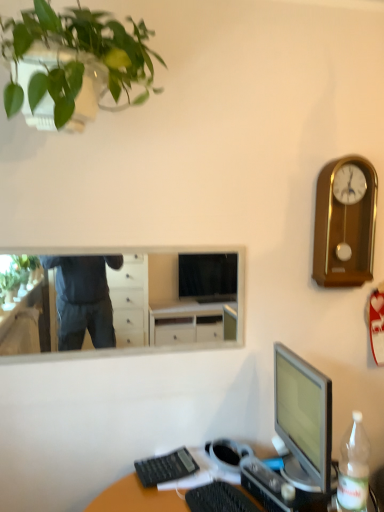
This screenshot has width=384, height=512. What do you see at coordinates (354, 467) in the screenshot? I see `clear plastic bottle at lower right` at bounding box center [354, 467].

Measure the distance between translucent plastic desk at lower right and camera.

translucent plastic desk at lower right and camera are 4.25 feet apart from each other.

Measure the distance between black plastic keyboard at lower center, positioned as the 1th computer keyboard in front-to-back order, and camera.

black plastic keyboard at lower center, positioned as the 1th computer keyboard in front-to-back order, and camera are 1.28 meters apart from each other.

Image resolution: width=384 pixels, height=512 pixels. Find the location of `white glossy mirror at upper center`. white glossy mirror at upper center is located at coordinates (128, 303).

Image resolution: width=384 pixels, height=512 pixels. What are the coordinates of `green matte plant at upper left` in the screenshot? It's located at (75, 56).

Is gold polished wood clock at upper right located outside clear plastic bottle at lower right?

gold polished wood clock at upper right is positioned outside clear plastic bottle at lower right.

Is gold polished wood clock at upper right closer to the viewer compared to clear plastic bottle at lower right?

No, gold polished wood clock at upper right is further to the viewer.

From their relative heights in the image, would you say gold polished wood clock at upper right is taller or shorter than clear plastic bottle at lower right?

gold polished wood clock at upper right is taller than clear plastic bottle at lower right.

Consider the image. Could you tell me if gold polished wood clock at upper right is facing clear plastic bottle at lower right?

No, gold polished wood clock at upper right is not aimed at clear plastic bottle at lower right.

Are white glossy mirror at upper center and gold polished wood clock at upper right making contact?

white glossy mirror at upper center and gold polished wood clock at upper right are clearly separated.

Between point (55, 273) and point (361, 203), which one is positioned behind?

The point (55, 273) is behind.

Does white glossy mirror at upper center have a greater height compared to gold polished wood clock at upper right?

In fact, white glossy mirror at upper center may be shorter than gold polished wood clock at upper right.

From a real-world perspective, is white glossy mirror at upper center above or below gold polished wood clock at upper right?

In terms of real-world spatial position, white glossy mirror at upper center is below gold polished wood clock at upper right.

Considering the positions of point (157, 498) and point (28, 99), is point (157, 498) closer or farther from the camera than point (28, 99)?

Point (157, 498) appears to be farther away from the viewer than point (28, 99).

Which of these two, translucent plastic desk at lower right or green matte plant at upper left, is wider?

green matte plant at upper left.

Is translucent plastic desk at lower right further to the viewer compared to green matte plant at upper left?

Yes, translucent plastic desk at lower right is further from the camera.

Locate an element on the screen. The width and height of the screenshot is (384, 512). houseplant in front of the translucent plastic desk at lower right is located at coordinates (75, 56).

Considering the sizes of objects gold polished wood clock at upper right and white glossy mirror at upper center in the image provided, who is bigger, gold polished wood clock at upper right or white glossy mirror at upper center?

Bigger between the two is gold polished wood clock at upper right.

Which of these two, gold polished wood clock at upper right or white glossy mirror at upper center, stands taller?

gold polished wood clock at upper right.

In the image, is gold polished wood clock at upper right positioned in front of or behind white glossy mirror at upper center?

gold polished wood clock at upper right is behind white glossy mirror at upper center.

Is clear plastic bottle at lower right next to green matte plant at upper left and touching it?

clear plastic bottle at lower right and green matte plant at upper left are not in contact.

Which is farther, (357, 443) or (84, 58)?

The point (357, 443) is more distant.

Which object is closer to the camera, clear plastic bottle at lower right or green matte plant at upper left?

green matte plant at upper left is closer to the camera.

Visually, is clear plastic bottle at lower right positioned to the left or to the right of green matte plant at upper left?

clear plastic bottle at lower right is to the right of green matte plant at upper left.

From a real-world perspective, which object rests below the other?

From a 3D spatial view, black plastic keyboard at lower center, which is the 1th computer keyboard in left-to-right order, is below.

Can you tell me how much gold polished wood clock at upper right and black plastic keyboard at lower center, which is the 1th computer keyboard in left-to-right order, differ in facing direction?

The angle between the facing direction of gold polished wood clock at upper right and the facing direction of black plastic keyboard at lower center, which is the 1th computer keyboard in left-to-right order, is 81.2 degrees.

Is gold polished wood clock at upper right next to black plastic keyboard at lower center, which is the second computer keyboard from right to left?

No, gold polished wood clock at upper right is not making contact with black plastic keyboard at lower center, which is the second computer keyboard from right to left.

Is point (371, 183) closer or farther from the camera than point (144, 470)?

Point (371, 183) is farther from the camera than point (144, 470).

In terms of width, does clear plastic bottle at lower right look wider or thinner when compared to white glossy mirror at upper center?

clear plastic bottle at lower right is wider than white glossy mirror at upper center.

Measure the distance from clear plastic bottle at lower right to white glossy mirror at upper center.

clear plastic bottle at lower right is 6.86 feet from white glossy mirror at upper center.

Between point (346, 487) and point (210, 320), which one is positioned behind?

Positioned behind is point (210, 320).

The image size is (384, 512). In order to click on clock above the clear plastic bottle at lower right (from the image's perspective) in this screenshot , I will do `click(345, 222)`.

Image resolution: width=384 pixels, height=512 pixels. What are the coordinates of `mirror below the gold polished wood clock at upper right (from the image's perspective)` in the screenshot? It's located at (128, 303).

Looking at the image, which one is located closer to black plastic keyboard at lower center, which is the 2th computer keyboard from front to back, gold polished wood clock at upper right or white glossy mirror at upper center?

gold polished wood clock at upper right is closer to black plastic keyboard at lower center, which is the 2th computer keyboard from front to back.

From the picture: Based on their spatial positions, is black plastic keyboard at lower center, which ranks as the first computer keyboard in back-to-front order, or translucent plastic desk at lower right closer to gold polished wood clock at upper right?

Among the two, translucent plastic desk at lower right is located nearer to gold polished wood clock at upper right.

Based on their spatial positions, is clear plastic bottle at lower right or green matte plant at upper left closer to black plastic keyboard at lower center, which is the 2th computer keyboard from front to back?

clear plastic bottle at lower right lies closer to black plastic keyboard at lower center, which is the 2th computer keyboard from front to back, than the other object.

Estimate the real-world distances between objects in this image. Which object is further from gold polished wood clock at upper right, clear plastic bottle at lower right or black plastic keyboard at lower center, positioned as the 1th computer keyboard in front-to-back order?

black plastic keyboard at lower center, positioned as the 1th computer keyboard in front-to-back order, is further to gold polished wood clock at upper right.

Estimate the real-world distances between objects in this image. Which object is further from clear plastic bottle at lower right, white glossy mirror at upper center or translucent plastic desk at lower right?

white glossy mirror at upper center is positioned further to the anchor clear plastic bottle at lower right.

Based on their spatial positions, is black plastic keyboard at lower center, which ranks as the first computer keyboard in back-to-front order, or translucent plastic desk at lower right closer to clear plastic bottle at lower right?

Among the two, translucent plastic desk at lower right is located nearer to clear plastic bottle at lower right.

Considering their positions, is black plastic keyboard at lower center, positioned as the 1th computer keyboard in front-to-back order, positioned further to gold polished wood clock at upper right than green matte plant at upper left?

The object further to gold polished wood clock at upper right is black plastic keyboard at lower center, positioned as the 1th computer keyboard in front-to-back order.

Based on their spatial positions, is clear plastic bottle at lower right or translucent plastic desk at lower right further from black plastic keyboard at lower center, which is the second computer keyboard from right to left?

clear plastic bottle at lower right is positioned further to the anchor black plastic keyboard at lower center, which is the second computer keyboard from right to left.

Find the location of a particular element. mirror between green matte plant at upper left and black plastic keyboard at lower center, which is the 2th computer keyboard from front to back, from top to bottom is located at coordinates (128, 303).

Where is `bottle between gold polished wood clock at upper right and black plastic keyboard at lower center, which is the 1th computer keyboard in left-to-right order, vertically`? bottle between gold polished wood clock at upper right and black plastic keyboard at lower center, which is the 1th computer keyboard in left-to-right order, vertically is located at coordinates (354, 467).

Image resolution: width=384 pixels, height=512 pixels. I want to click on mirror between green matte plant at upper left and translucent plastic desk at lower right in the up-down direction, so click(128, 303).

Where is `bottle between white glossy mirror at upper center and gold polished wood clock at upper right`? bottle between white glossy mirror at upper center and gold polished wood clock at upper right is located at coordinates (354, 467).